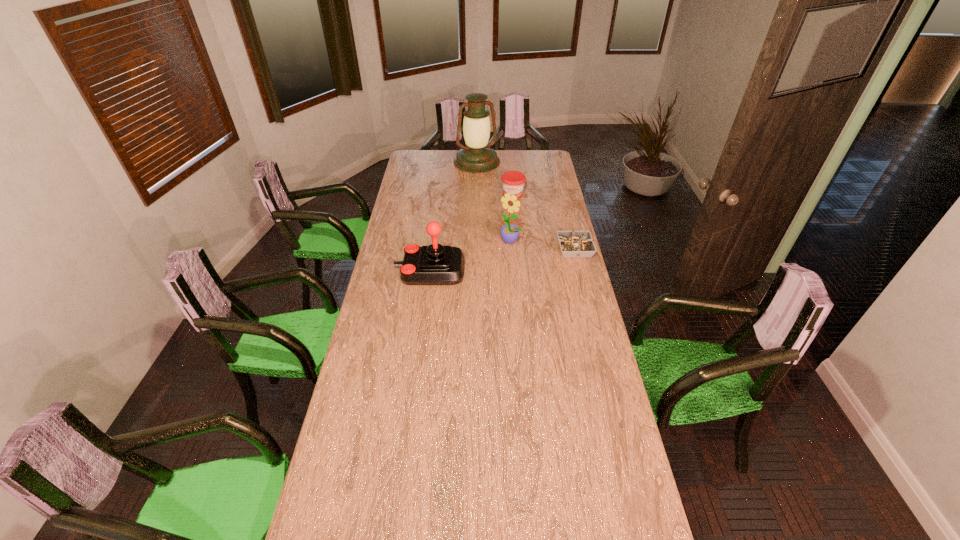
The width and height of the screenshot is (960, 540). Find the location of `vacant space on the desktop that is between the joystick and the ashtray and is positioned with the light compartment facing forward on the lantern`. vacant space on the desktop that is between the joystick and the ashtray and is positioned with the light compartment facing forward on the lantern is located at coordinates (520, 257).

In order to click on vacant space on the desktop that is between the joystick and the rightmost object and is positioned on the front-facing side of the sunflower in this screenshot , I will do `click(490, 262)`.

Locate an element on the screen. free space on the desktop that is between the joystick and the ashtray and is positioned on the label side of the jam is located at coordinates (505, 259).